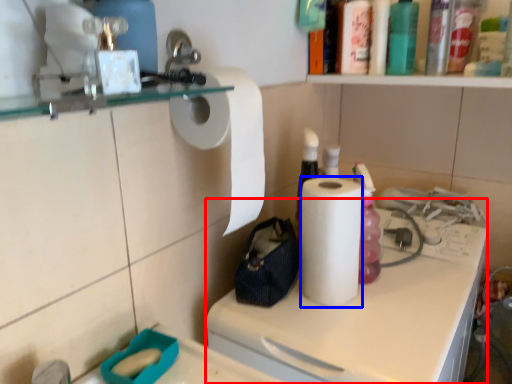
Question: Which of the following is the closest to the observer, counter (highlighted by a red box) or paper towel (highlighted by a blue box)?

Choices:
 (A) counter
 (B) paper towel

Answer: (A)